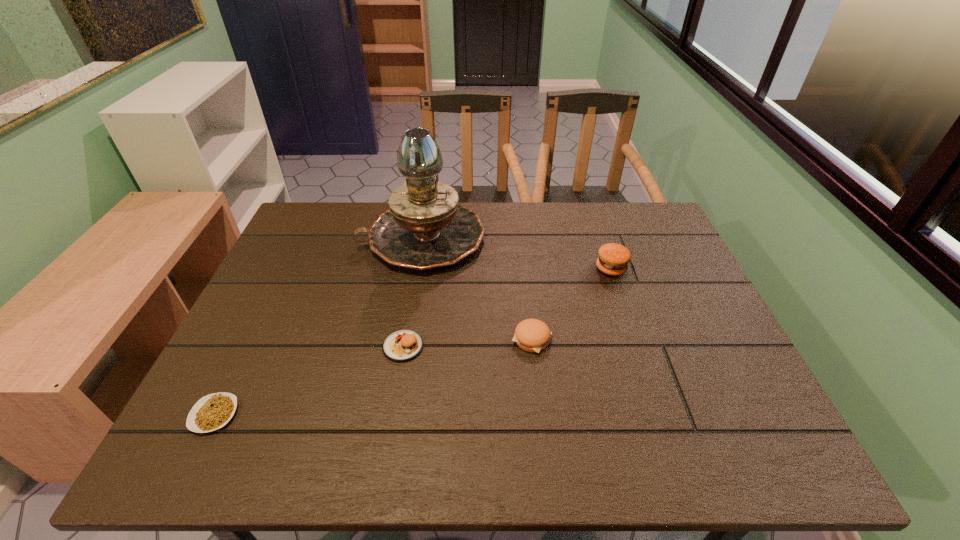
This screenshot has height=540, width=960. In the image, there is a desktop. Find the location of `vacant space at the right edge`. vacant space at the right edge is located at coordinates (704, 300).

Find the location of `free spot at the far left corner of the desktop`. free spot at the far left corner of the desktop is located at coordinates (342, 219).

I want to click on vacant space at the near left corner of the desktop, so click(x=209, y=460).

The image size is (960, 540). What are the coordinates of `free space at the far right corner of the desktop` in the screenshot? It's located at (618, 219).

Image resolution: width=960 pixels, height=540 pixels. In order to click on unoccupied area between the rightmost object and the leftmost patty in this screenshot , I will do `click(507, 307)`.

You are a GUI agent. You are given a task and a screenshot of the screen. Output one action in this format:
    pyautogui.click(x=<x>, y=<y>)
    Task: Click on the free point between the tallest patty and the leftmost patty
    This screenshot has height=540, width=960.
    Given the screenshot: What is the action you would take?
    pyautogui.click(x=507, y=307)

Image resolution: width=960 pixels, height=540 pixels. I want to click on vacant area that lies between the oil lamp and the leftmost patty, so click(413, 292).

Identify the location of free space that is in between the leftmost patty and the fourth object from left to right. (468, 343).

At what (x,y) coordinates should I click in order to perform the action: click on empty location between the oil lamp and the fourth object from left to right. Please return your answer as a coordinate pair (x, y). This screenshot has height=540, width=960. Looking at the image, I should click on (477, 289).

Find the location of a particular element. This screenshot has height=540, width=960. free area in between the second shortest object and the leftmost patty is located at coordinates (468, 343).